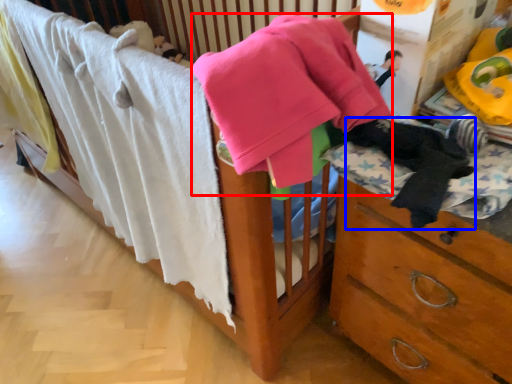
Question: Which object appears closest to the camera in this image, baby clothe (highlighted by a red box) or clothing (highlighted by a blue box)?

Choices:
 (A) baby clothe
 (B) clothing

Answer: (A)